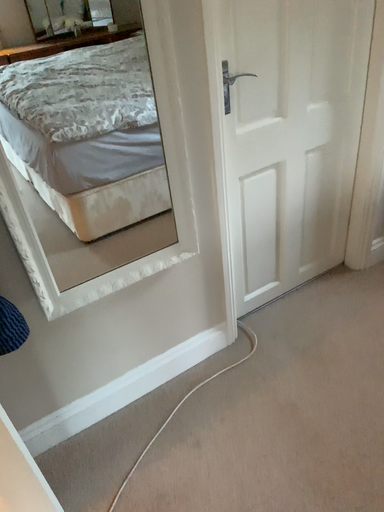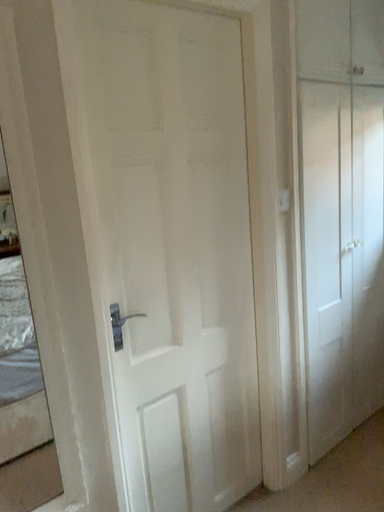
Question: How did the camera likely rotate when shooting the video?

Choices:
 (A) rotated right
 (B) rotated left

Answer: (A)